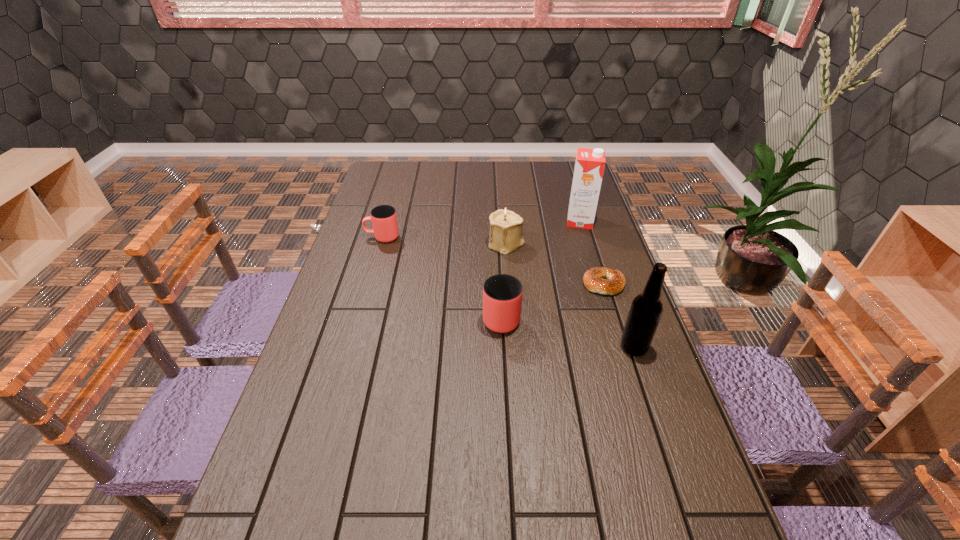
Please point a spot to add another cup on the right. Please provide its 2D coordinates. Your answer should be formatted as a tuple, i.e. [(x, y)], where the tuple contains the x and y coordinates of a point satisfying the conditions above.

[(690, 441)]